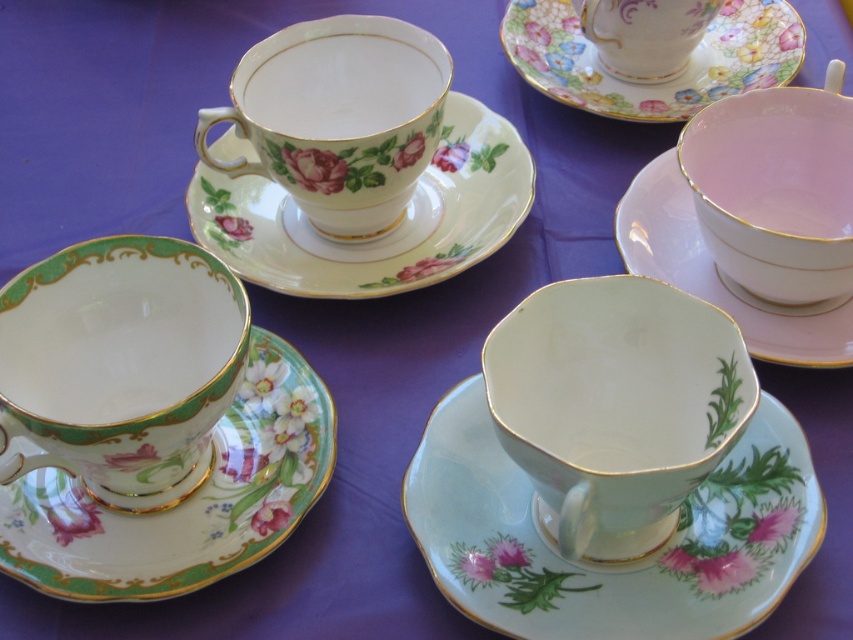
Question: Which object is positioned closest to the porcelain cup at center?

Choices:
 (A) green porcelain teacup at left
 (B) floral porcelain plate at upper right

Answer: (A)

Question: Observing the image, what is the correct spatial positioning of floral porcelain plate at upper right in reference to porcelain floral teacup at upper right?

Choices:
 (A) above
 (B) below

Answer: (B)

Question: From the image, what is the correct spatial relationship of pink glossy bowl at upper right in relation to floral porcelain plate at upper right?

Choices:
 (A) right
 (B) left

Answer: (A)

Question: Can you confirm if porcelain floral plate at center-left is positioned above porcelain floral teacup at upper right?

Choices:
 (A) no
 (B) yes

Answer: (A)

Question: Which of the following is the closest to the observer?

Choices:
 (A) light blue porcelain cup at center
 (B) porcelain floral plate at center-left
 (C) matte porcelain teacup at upper center

Answer: (A)

Question: Estimate the real-world distances between objects in this image. Which object is farther from the pink matte saucer at upper right?

Choices:
 (A) green porcelain teacup at left
 (B) porcelain cup at center
 (C) pink glossy bowl at upper right
 (D) floral porcelain plate at upper right

Answer: (A)